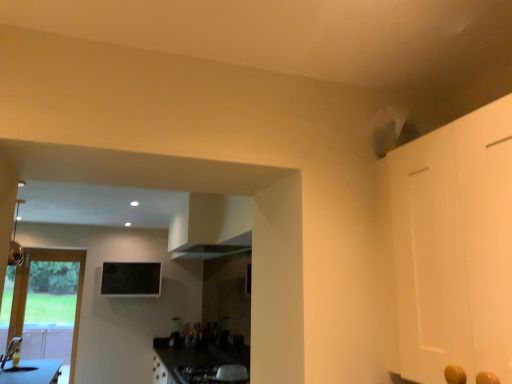
Question: Is the depth of wooden door at left greater than that of metallic silver gas stove at lower center?

Choices:
 (A) no
 (B) yes

Answer: (B)

Question: Can you confirm if wooden door at left is shorter than metallic silver gas stove at lower center?

Choices:
 (A) no
 (B) yes

Answer: (A)

Question: Does wooden door at left turn towards metallic silver gas stove at lower center?

Choices:
 (A) no
 (B) yes

Answer: (A)

Question: Is wooden door at left positioned before metallic silver gas stove at lower center?

Choices:
 (A) no
 (B) yes

Answer: (A)

Question: Would you say wooden door at left contains metallic silver gas stove at lower center?

Choices:
 (A) yes
 (B) no

Answer: (B)

Question: Is wooden door at left taller than metallic silver gas stove at lower center?

Choices:
 (A) yes
 (B) no

Answer: (A)

Question: From a real-world perspective, is wooden door at left beneath black glass window screen at upper center?

Choices:
 (A) no
 (B) yes

Answer: (B)

Question: Is black glass window screen at upper center inside wooden door at left?

Choices:
 (A) no
 (B) yes

Answer: (A)

Question: Does wooden door at left have a smaller size compared to black glass window screen at upper center?

Choices:
 (A) no
 (B) yes

Answer: (A)

Question: Can you confirm if wooden door at left is positioned to the right of black glass window screen at upper center?

Choices:
 (A) no
 (B) yes

Answer: (A)

Question: Can you confirm if wooden door at left is wider than black glass window screen at upper center?

Choices:
 (A) no
 (B) yes

Answer: (A)

Question: Is wooden door at left facing away from black glass window screen at upper center?

Choices:
 (A) yes
 (B) no

Answer: (B)

Question: From a real-world perspective, is black glass window screen at upper center over wooden door at left?

Choices:
 (A) no
 (B) yes

Answer: (B)